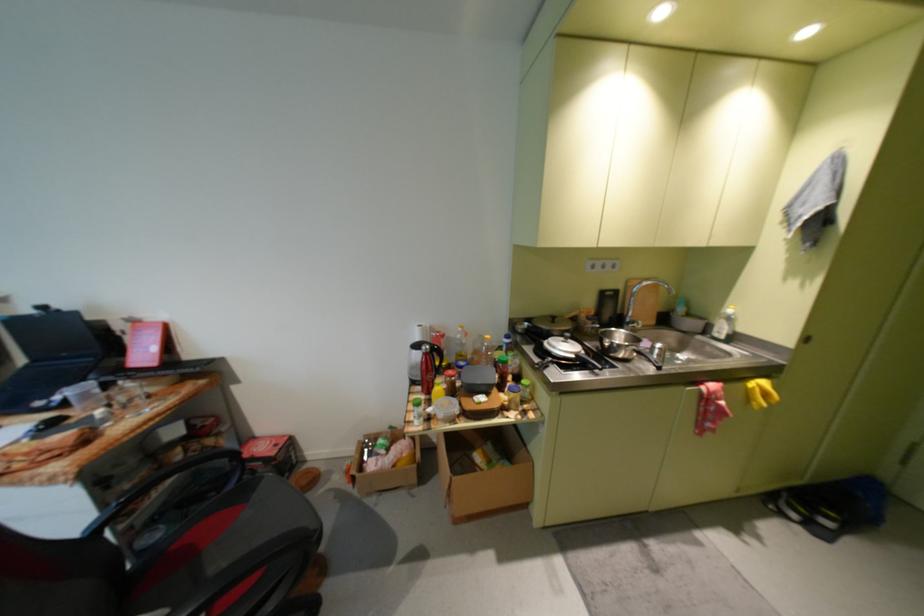
Which object does [128,394] point to?

It refers to a small glass jar.